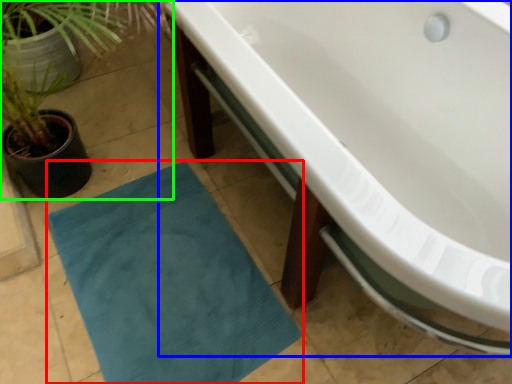
Question: Considering the real-world distances, which object is farthest from bath mat (highlighted by a red box)? bathtub (highlighted by a blue box) or houseplant (highlighted by a green box)?

Choices:
 (A) bathtub
 (B) houseplant

Answer: (A)